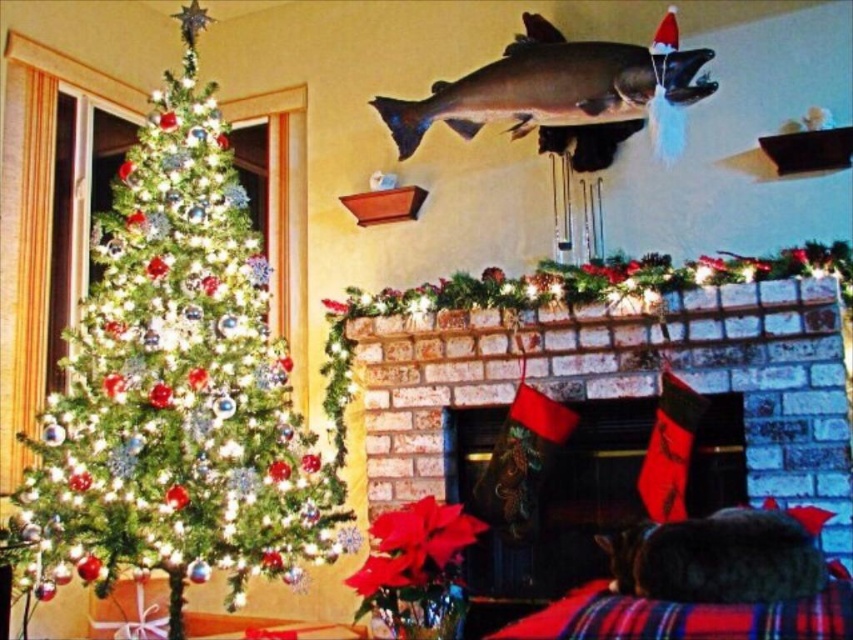
Question: Which of the following is the closest to the observer?

Choices:
 (A) green matte christmas tree at left
 (B) brick fireplace at center
 (C) shiny metallic fish at upper center

Answer: (B)

Question: Which object is closer to the camera taking this photo?

Choices:
 (A) green matte christmas tree at left
 (B) brick fireplace at center

Answer: (B)

Question: Does brick fireplace at center come in front of shiny metallic fish at upper center?

Choices:
 (A) no
 (B) yes

Answer: (B)

Question: Is brick fireplace at center below shiny metallic fish at upper center?

Choices:
 (A) yes
 (B) no

Answer: (A)

Question: Considering the relative positions of green matte christmas tree at left and brick fireplace at center in the image provided, where is green matte christmas tree at left located with respect to brick fireplace at center?

Choices:
 (A) right
 (B) left

Answer: (B)

Question: Which object is the closest to the brick fireplace at center?

Choices:
 (A) shiny metallic fish at upper center
 (B) green matte christmas tree at left

Answer: (A)